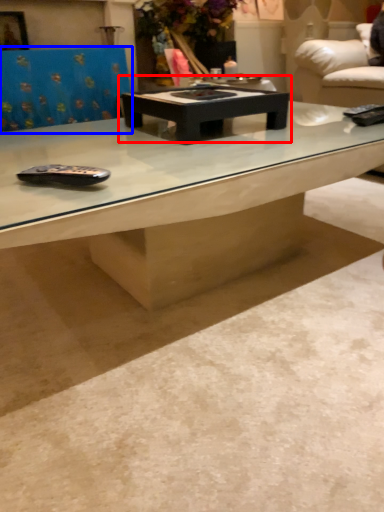
Question: Which point is closer to the camera, coffee table (highlighted by a red box) or swivel chair (highlighted by a blue box)?

Choices:
 (A) coffee table
 (B) swivel chair

Answer: (A)